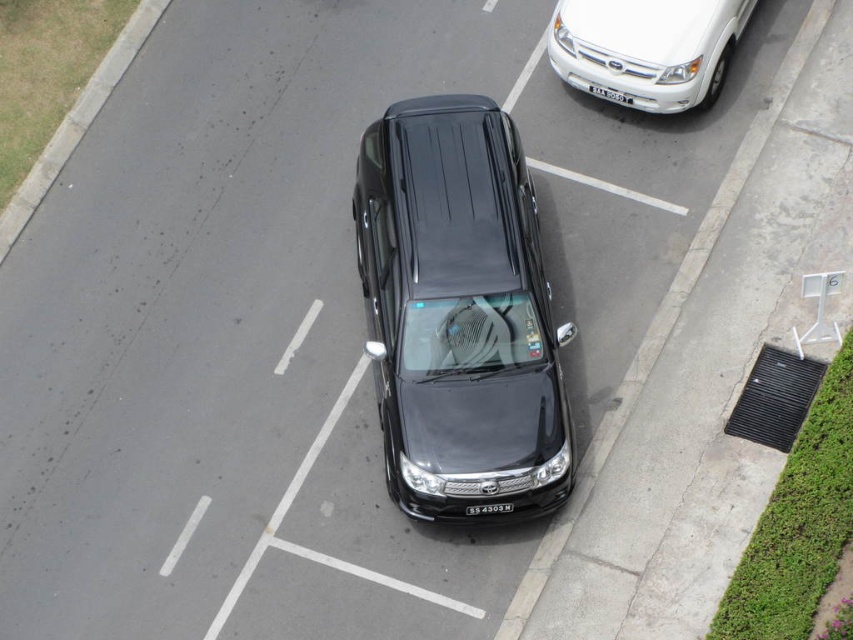
Question: Which of the following is the farthest from the observer?

Choices:
 (A) black plastic license plate at center
 (B) white plastic license plate at center

Answer: (B)

Question: Can you confirm if black metal grate at lower right is bigger than white plastic license plate at center?

Choices:
 (A) no
 (B) yes

Answer: (B)

Question: Which object is the farthest from the white glossy suv at upper right?

Choices:
 (A) black glossy sedan at center
 (B) black plastic license plate at center
 (C) white plastic license plate at center
 (D) black metal grate at lower right

Answer: (B)

Question: Does black glossy sedan at center appear under white glossy suv at upper right?

Choices:
 (A) no
 (B) yes

Answer: (B)

Question: Is black glossy sedan at center in front of white glossy suv at upper right?

Choices:
 (A) no
 (B) yes

Answer: (B)

Question: Based on their relative distances, which object is farther from the black glossy sedan at center?

Choices:
 (A) black metal grate at lower right
 (B) white plastic license plate at center
 (C) black plastic license plate at center

Answer: (B)